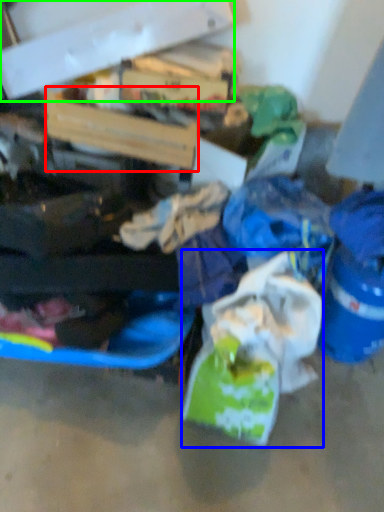
Question: Which is nearer to the box (highlighted by a red box)? plastic bag (highlighted by a blue box) or box (highlighted by a green box).

Choices:
 (A) plastic bag
 (B) box

Answer: (B)